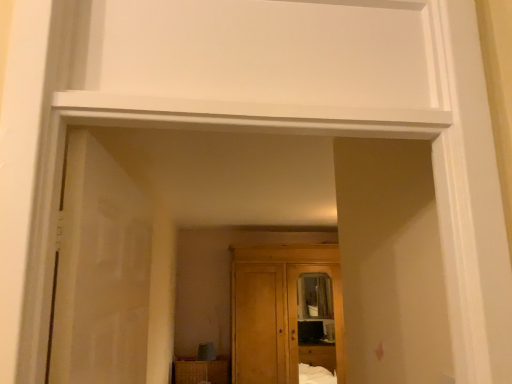
Describe the element at coordinates (111, 268) in the screenshot. I see `translucent glass door at left` at that location.

You are a GUI agent. You are given a task and a screenshot of the screen. Output one action in this format:
    pyautogui.click(x=<x>, y=<y>)
    Task: Click on the wooden cupboard at center
    The height and width of the screenshot is (384, 512).
    Given the screenshot: What is the action you would take?
    pyautogui.click(x=276, y=309)

You are a GUI agent. You are given a task and a screenshot of the screen. Output one action in this format:
    pyautogui.click(x=<x>, y=<y>)
    Task: Click on the wooden cabinet at lower center
    This screenshot has height=384, width=512.
    Given the screenshot: What is the action you would take?
    pyautogui.click(x=201, y=370)

I want to click on translucent glass door at left, so click(111, 268).

Based on the photo, does wooden cabinet at lower center turn towards translucent glass door at left?

Yes, wooden cabinet at lower center is turned towards translucent glass door at left.

At what (x,y) coordinates should I click in order to perform the action: click on cabinetry below the translucent glass door at left (from the image's perspective). Please return your answer as a coordinate pair (x, y). The height and width of the screenshot is (384, 512). Looking at the image, I should click on (201, 370).

Considering the positions of objects wooden cabinet at lower center and translucent glass door at left in the image provided, who is behind, wooden cabinet at lower center or translucent glass door at left?

wooden cabinet at lower center is further away from the camera.

Is wooden cupboard at center bigger than wooden cabinet at lower center?

Indeed, wooden cupboard at center has a larger size compared to wooden cabinet at lower center.

Does wooden cupboard at center have a greater height compared to wooden cabinet at lower center?

Yes, wooden cupboard at center is taller than wooden cabinet at lower center.

Identify the location of cabinetry behind the wooden cupboard at center. The image size is (512, 384). (201, 370).

Is wooden cupboard at center inside the boundaries of wooden cabinet at lower center, or outside?

wooden cupboard at center exists outside the volume of wooden cabinet at lower center.

From a real-world perspective, is translucent glass door at left physically above wooden cabinet at lower center?

Yes, from a real-world perspective, translucent glass door at left is above wooden cabinet at lower center.

Consider the image. Who is smaller, translucent glass door at left or wooden cabinet at lower center?

Smaller between the two is translucent glass door at left.

Does translucent glass door at left appear on the right side of wooden cabinet at lower center?

Yes.

You are a GUI agent. You are given a task and a screenshot of the screen. Output one action in this format:
    pyautogui.click(x=<x>, y=<y>)
    Task: Click on the door above the wooden cabinet at lower center (from a real-world perspective)
    
    Given the screenshot: What is the action you would take?
    pyautogui.click(x=111, y=268)

Is wooden cupboard at center next to translucent glass door at left and touching it?

No.

From the image's perspective, is wooden cupboard at center located beneath translucent glass door at left?

Indeed, from the image's perspective, wooden cupboard at center is shown beneath translucent glass door at left.

Considering the sizes of objects wooden cupboard at center and translucent glass door at left in the image provided, who is shorter, wooden cupboard at center or translucent glass door at left?

Standing shorter between the two is translucent glass door at left.

Between translucent glass door at left and wooden cupboard at center, which one has less height?

Standing shorter between the two is translucent glass door at left.

How different are the orientations of translucent glass door at left and wooden cupboard at center in degrees?

The facing directions of translucent glass door at left and wooden cupboard at center are 88.8 degrees apart.

Locate an element on the screen. Image resolution: width=512 pixels, height=384 pixels. door lying on the left of wooden cupboard at center is located at coordinates (111, 268).

From a real-world perspective, which object stands above the other?

wooden cupboard at center.

Where is `cupboard to the right of wooden cabinet at lower center`? The image size is (512, 384). cupboard to the right of wooden cabinet at lower center is located at coordinates (276, 309).

Can you see wooden cabinet at lower center touching wooden cupboard at center?

No, wooden cabinet at lower center is not in contact with wooden cupboard at center.

Is wooden cupboard at center at the back of wooden cabinet at lower center?

No, wooden cabinet at lower center is not facing the opposite direction of wooden cupboard at center.

Locate an element on the screen. The image size is (512, 384). cabinetry below the translucent glass door at left (from the image's perspective) is located at coordinates (201, 370).

Locate an element on the screen. This screenshot has height=384, width=512. cabinetry on the left of wooden cupboard at center is located at coordinates (201, 370).

Estimate the real-world distances between objects in this image. Which object is further from wooden cabinet at lower center, wooden cupboard at center or translucent glass door at left?

Among the two, translucent glass door at left is located further to wooden cabinet at lower center.

Considering their positions, is wooden cabinet at lower center positioned further to translucent glass door at left than wooden cupboard at center?

The object further to translucent glass door at left is wooden cabinet at lower center.

From the image, which object appears to be farther from wooden cabinet at lower center, translucent glass door at left or wooden cupboard at center?

→ Based on the image, translucent glass door at left appears to be further to wooden cabinet at lower center.

From the image, which object appears to be nearer to wooden cupboard at center, wooden cabinet at lower center or translucent glass door at left?

wooden cabinet at lower center.

Looking at the image, which one is located closer to translucent glass door at left, wooden cupboard at center or wooden cabinet at lower center?

wooden cupboard at center is positioned closer to the anchor translucent glass door at left.

In the scene shown: From the image, which object appears to be farther from wooden cupboard at center, translucent glass door at left or wooden cabinet at lower center?

translucent glass door at left is further to wooden cupboard at center.

Locate an element on the screen. cupboard positioned between translucent glass door at left and wooden cabinet at lower center from near to far is located at coordinates (276, 309).